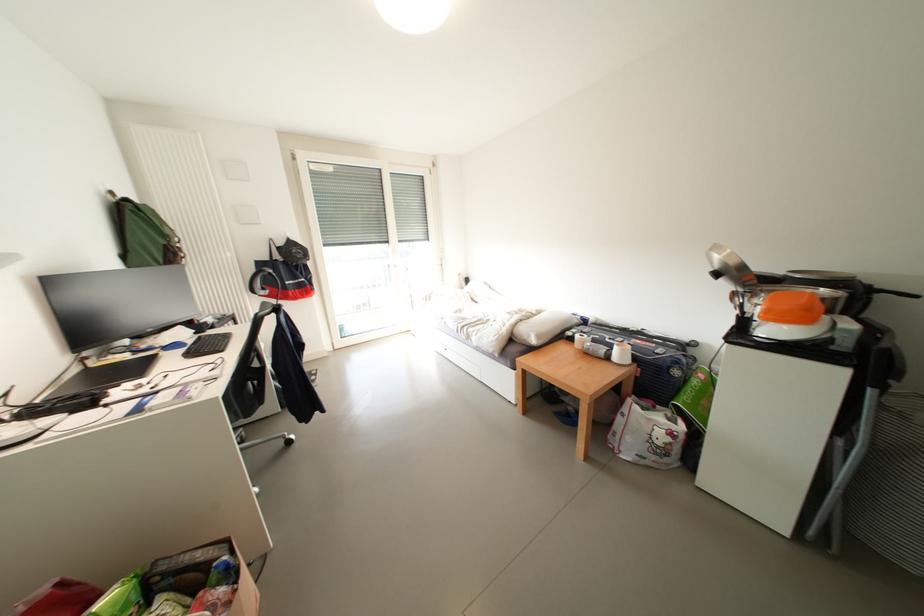
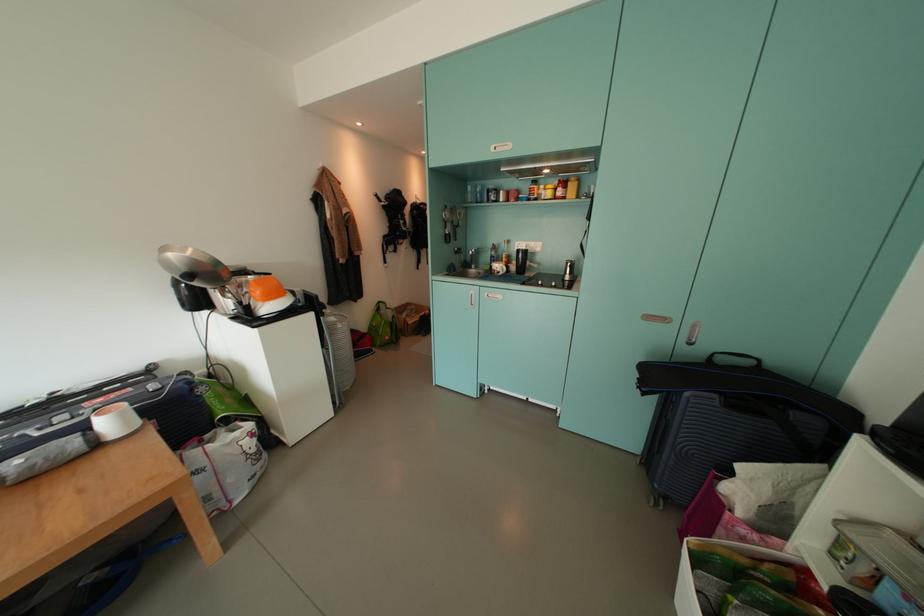
The first image is from the beginning of the video and the second image is from the end. How did the camera likely rotate when shooting the video?

The camera's rotation is toward right-down.